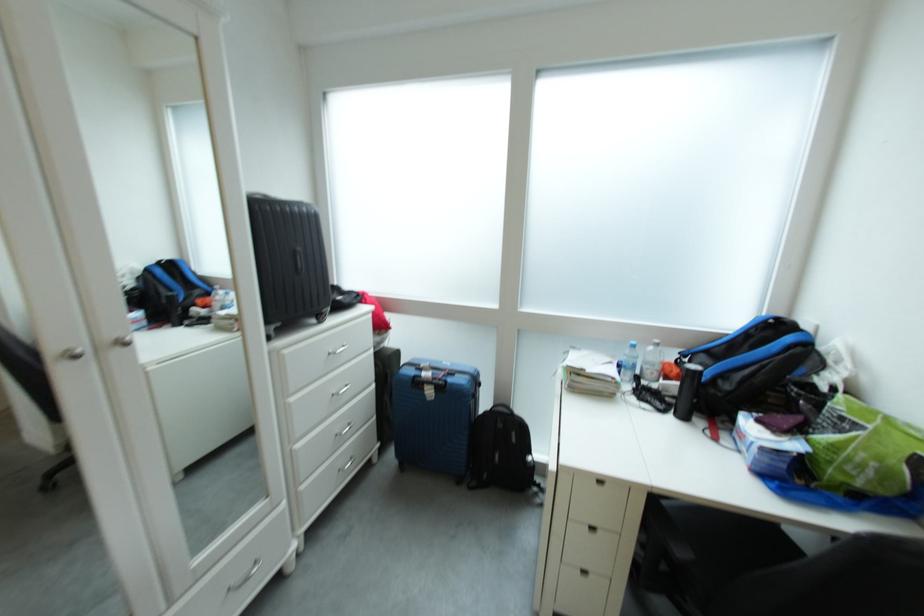
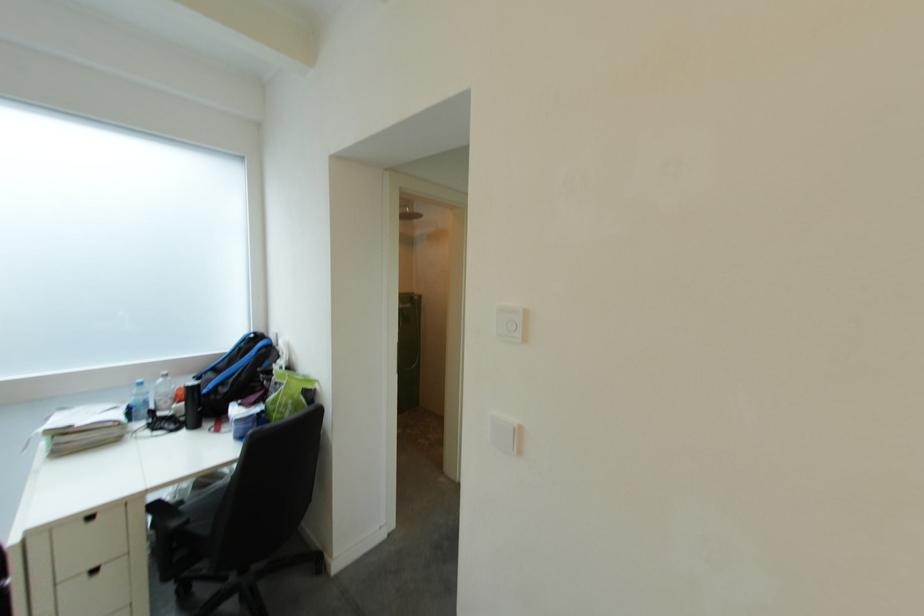
The point at (881, 476) is marked in the first image. Where is the corresponding point in the second image?

(301, 410)